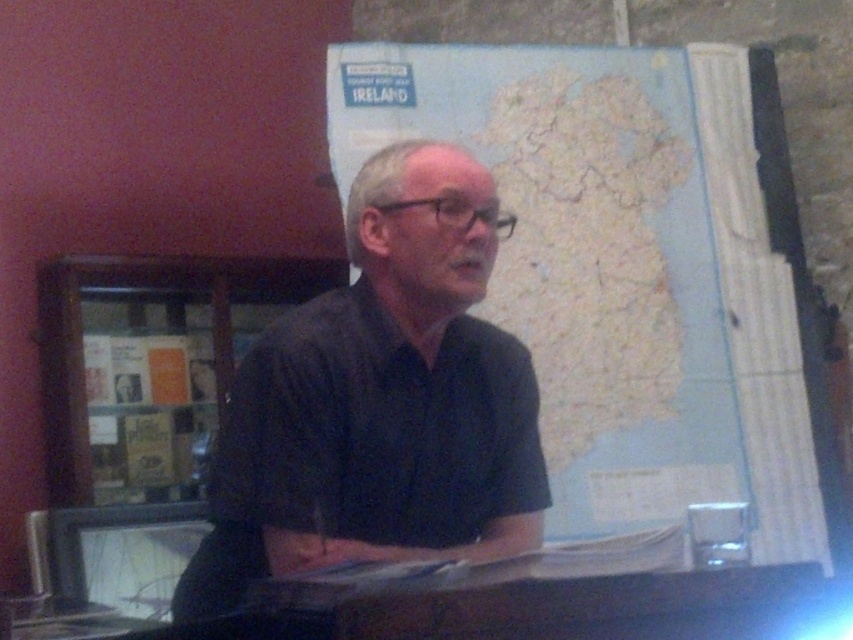
You are an interior designer observing the scene. You need to place a new decorative item between the black matte shirt at center and the matte plastic computer screen at lower left. Based on their current positions, where should you place the new item to maintain symmetry?

The black matte shirt at center is positioned on the right side of the matte plastic computer screen at lower left, so placing the new item between them would require positioning it to the right of the matte plastic computer screen at lower left and to the left of the black matte shirt at center to maintain symmetry.